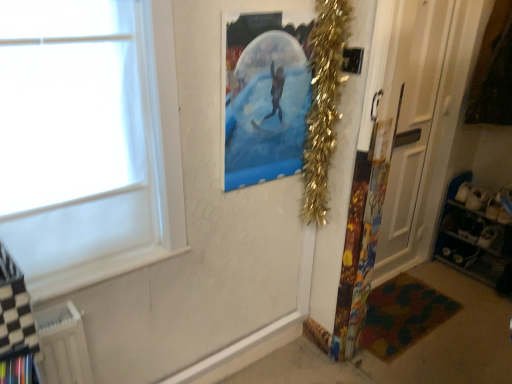
The width and height of the screenshot is (512, 384). In order to click on free space that is in between metallic blue shelves at lower right and multicolored fabric mat at lower right in this screenshot , I will do `click(451, 296)`.